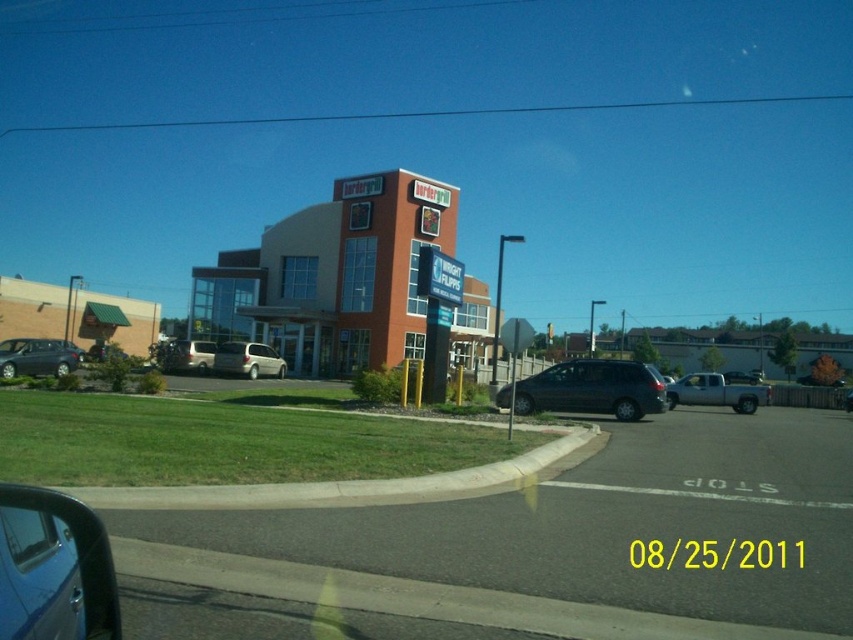
Based on the photo, you are driving a metallic blue car at lower left and want to turn right into the parking lot. The silver metallic truck at right is blocking your path. Can you safely navigate around the truck to enter the parking lot?

The metallic blue car at lower left is located above the silver metallic truck at right, meaning it is positioned higher up and possibly closer to the road. Since the truck is further back, you can safely maneuver around it by moving forward towards the parking entrance without obstruction.

You are driving a car and want to park in the parking lot near the building with the red facade. You see a metallic blue car at lower left and a silver metallic truck at right. Which vehicle should you avoid parking between to stay within the parking lines?

You should avoid parking between the metallic blue car at lower left and the silver metallic truck at right because the metallic blue car at lower left is to the left of the silver metallic truck at right, indicating they are parked next to each other with limited space between them.